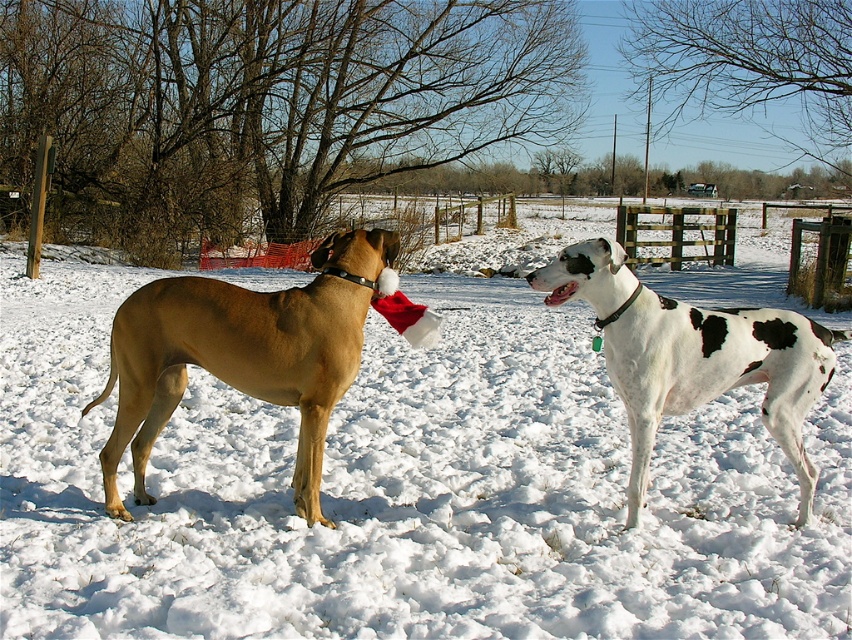
You are a photographer trying to capture a photo of the golden fur coat at left and the white fluffy snow at center. Based on their positions, which object is closer to the left edge of the photo?

The golden fur coat at left is closer to the left edge of the photo because it is positioned to the left of the white fluffy snow at center.